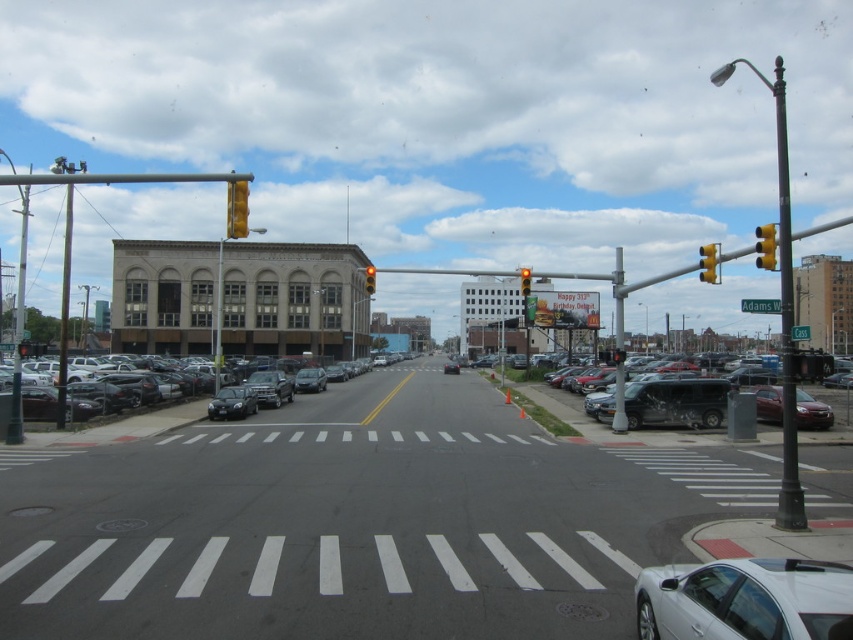
Question: Which of the following is the closest to the observer?

Choices:
 (A) yellow plastic traffic light at upper center
 (B) metallic pole at center
 (C) red glass traffic light at upper center

Answer: (A)

Question: Which of the following is the farthest from the observer?

Choices:
 (A) (792, 561)
 (B) (137, 413)
 (C) (160, 497)
 (D) (805, 518)

Answer: (B)

Question: Which of the following is the closest to the observer?

Choices:
 (A) [x=781, y=148]
 (B) [x=416, y=584]

Answer: (B)

Question: Where is white glossy sedan at lower right located in relation to matte black van at right in the image?

Choices:
 (A) left
 (B) right

Answer: (A)

Question: Can you confirm if white glossy sedan at lower right is positioned below yellow matte traffic light at upper center?

Choices:
 (A) no
 (B) yes

Answer: (B)

Question: Does smooth asphalt road at center have a smaller size compared to metallic pole at center?

Choices:
 (A) yes
 (B) no

Answer: (A)